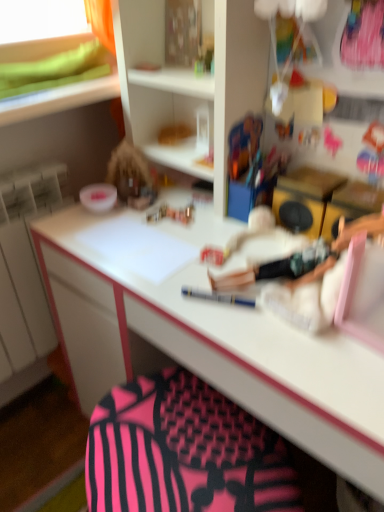
What do you see at coordinates (98, 197) in the screenshot? Image resolution: width=384 pixels, height=512 pixels. I see `white glossy bowl at upper left` at bounding box center [98, 197].

Where is `white glossy bowl at upper left`? The image size is (384, 512). white glossy bowl at upper left is located at coordinates (98, 197).

What is the approximate width of white glossy bowl at upper left?

white glossy bowl at upper left is 9.96 centimeters in width.

Describe the element at coordinates (184, 452) in the screenshot. I see `pink fabric swivel chair at lower center` at that location.

Where is `pink fabric swivel chair at lower center`? pink fabric swivel chair at lower center is located at coordinates (184, 452).

What are the coordinates of `white glossy bowl at upper left` in the screenshot? It's located at (98, 197).

Which object is positioned more to the left, white glossy bowl at upper left or pink fabric swivel chair at lower center?

Positioned to the left is white glossy bowl at upper left.

Is white glossy bowl at upper left positioned in front of pink fabric swivel chair at lower center?

No, it is behind pink fabric swivel chair at lower center.

Is point (114, 188) in front of point (183, 399)?

No, (114, 188) is behind (183, 399).

From the image's perspective, would you say white glossy bowl at upper left is shown under pink fabric swivel chair at lower center?

No, from the image's perspective, white glossy bowl at upper left is not below pink fabric swivel chair at lower center.

From a real-world perspective, is white glossy bowl at upper left under pink fabric swivel chair at lower center?

No.

Can you confirm if white glossy bowl at upper left is thinner than pink fabric swivel chair at lower center?

Yes, white glossy bowl at upper left is thinner than pink fabric swivel chair at lower center.

In terms of height, does white glossy bowl at upper left look taller or shorter compared to pink fabric swivel chair at lower center?

Considering their sizes, white glossy bowl at upper left has less height than pink fabric swivel chair at lower center.

Does white glossy bowl at upper left have a larger size compared to pink fabric swivel chair at lower center?

No, white glossy bowl at upper left is not bigger than pink fabric swivel chair at lower center.

Is pink fabric swivel chair at lower center located within white glossy bowl at upper left?

No, pink fabric swivel chair at lower center is located outside of white glossy bowl at upper left.

Would you consider white glossy bowl at upper left to be distant from pink fabric swivel chair at lower center?

No, there isn't a large distance between white glossy bowl at upper left and pink fabric swivel chair at lower center.

From the picture: Does white glossy bowl at upper left turn towards pink fabric swivel chair at lower center?

No, white glossy bowl at upper left is not oriented towards pink fabric swivel chair at lower center.

Can you tell me how much white glossy bowl at upper left and pink fabric swivel chair at lower center differ in facing direction?

They differ by 54.8 degrees in their facing directions.

The height and width of the screenshot is (512, 384). I want to click on swivel chair located underneath the white glossy bowl at upper left (from a real-world perspective), so click(x=184, y=452).

Looking at this image, is pink fabric swivel chair at lower center to the right of white glossy bowl at upper left from the viewer's perspective?

Yes, pink fabric swivel chair at lower center is to the right of white glossy bowl at upper left.

Is pink fabric swivel chair at lower center closer to the viewer compared to white glossy bowl at upper left?

Yes.

Which point is more distant from viewer, (125, 431) or (98, 184)?

The point (98, 184) is more distant.

From the image's perspective, which object appears higher, pink fabric swivel chair at lower center or white glossy bowl at upper left?

white glossy bowl at upper left is shown above in the image.

From a real-world perspective, is pink fabric swivel chair at lower center beneath white glossy bowl at upper left?

Yes, from a real-world perspective, pink fabric swivel chair at lower center is below white glossy bowl at upper left.

Is pink fabric swivel chair at lower center thinner than white glossy bowl at upper left?

No, pink fabric swivel chair at lower center is not thinner than white glossy bowl at upper left.

Is pink fabric swivel chair at lower center taller or shorter than white glossy bowl at upper left?

pink fabric swivel chair at lower center is taller than white glossy bowl at upper left.

Based on the photo, who is bigger, pink fabric swivel chair at lower center or white glossy bowl at upper left?

pink fabric swivel chair at lower center.

Would you say white glossy bowl at upper left is part of pink fabric swivel chair at lower center's contents?

No, white glossy bowl at upper left is not inside pink fabric swivel chair at lower center.

Would you consider pink fabric swivel chair at lower center to be distant from white glossy bowl at upper left?

No.

Is pink fabric swivel chair at lower center oriented towards white glossy bowl at upper left?

No, pink fabric swivel chair at lower center is not turned towards white glossy bowl at upper left.

How many degrees apart are the facing directions of pink fabric swivel chair at lower center and white glossy bowl at upper left?

The facing directions of pink fabric swivel chair at lower center and white glossy bowl at upper left are 54.8 degrees apart.

Find the location of a particular element. swivel chair that appears below the white glossy bowl at upper left (from the image's perspective) is located at coordinates (184, 452).

Locate an element on the screen. The width and height of the screenshot is (384, 512). stationery that is above the pink fabric swivel chair at lower center (from the image's perspective) is located at coordinates (98, 197).

At what (x,y) coordinates should I click in order to perform the action: click on swivel chair below the white glossy bowl at upper left (from a real-world perspective). Please return your answer as a coordinate pair (x, y). Image resolution: width=384 pixels, height=512 pixels. Looking at the image, I should click on (184, 452).